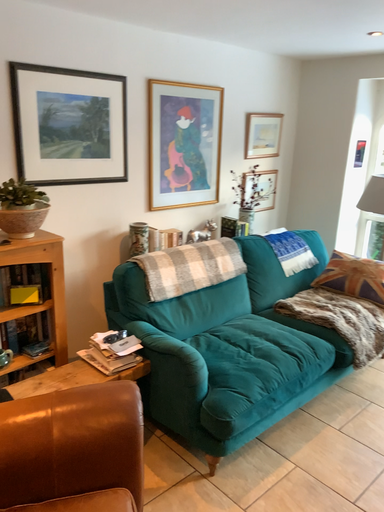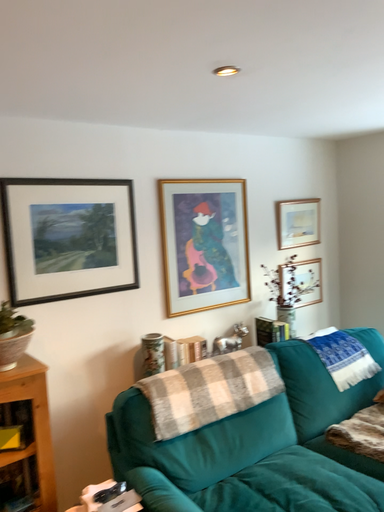
Question: How did the camera likely rotate when shooting the video?

Choices:
 (A) rotated left
 (B) rotated right

Answer: (A)